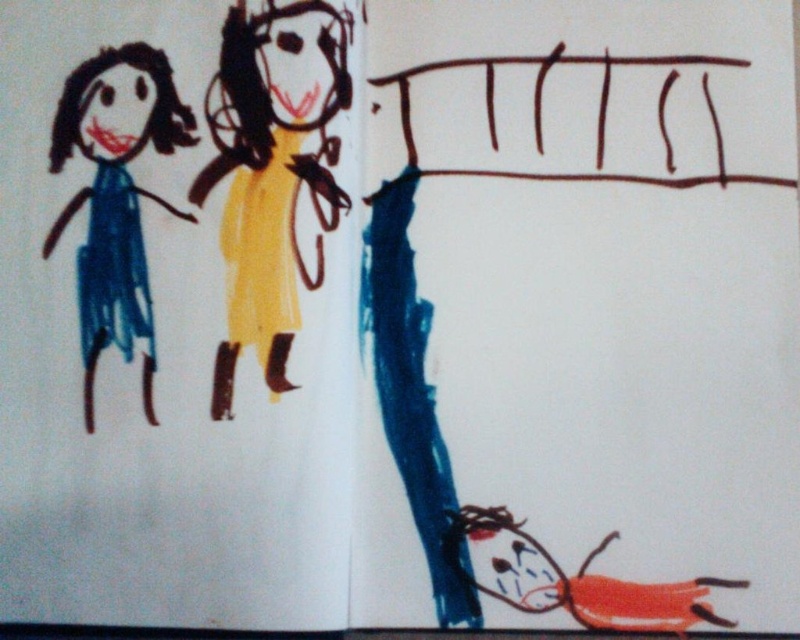
Question: Is yellow paper doll at center above matte blue dress at left?

Choices:
 (A) yes
 (B) no

Answer: (A)

Question: Is yellow paper doll at center to the right of matte blue dress at left from the viewer's perspective?

Choices:
 (A) no
 (B) yes

Answer: (B)

Question: Which of the following is the closest to the observer?

Choices:
 (A) yellow paper doll at center
 (B) matte blue dress at left

Answer: (A)

Question: Among these objects, which one is farthest from the camera?

Choices:
 (A) yellow paper doll at center
 (B) matte blue dress at left

Answer: (B)

Question: Is yellow paper doll at center to the right of matte blue dress at left from the viewer's perspective?

Choices:
 (A) yes
 (B) no

Answer: (A)